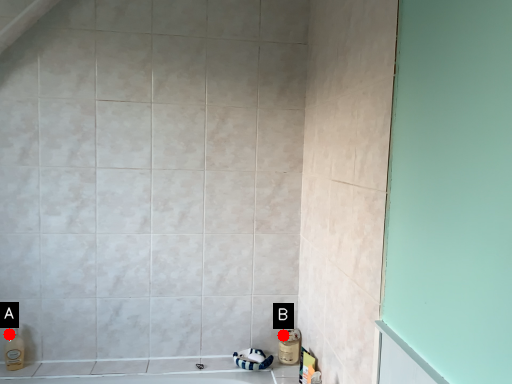
Question: Two points are circled on the image, labeled by A and B beside each circle. Among these points, which one is farthest from the camera?

Choices:
 (A) A is further
 (B) B is further

Answer: (B)